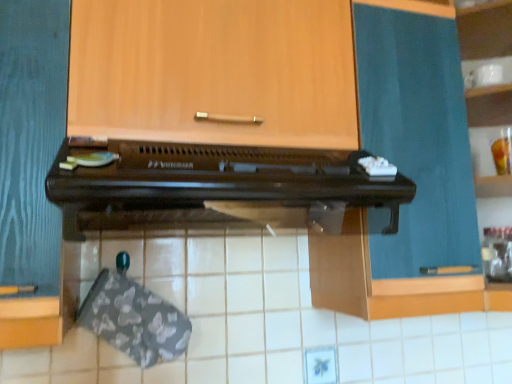
Question: From the image's perspective, does brown wooden oven at center appear higher than white glossy cup at upper right?

Choices:
 (A) no
 (B) yes

Answer: (A)

Question: Is brown wooden oven at center not close to white glossy cup at upper right?

Choices:
 (A) no
 (B) yes

Answer: (A)

Question: Is the depth of brown wooden oven at center greater than that of white glossy cup at upper right?

Choices:
 (A) no
 (B) yes

Answer: (A)

Question: Can white glossy cup at upper right be found inside brown wooden oven at center?

Choices:
 (A) no
 (B) yes

Answer: (A)

Question: From a real-world perspective, is brown wooden oven at center on top of white glossy cup at upper right?

Choices:
 (A) yes
 (B) no

Answer: (B)

Question: From a real-world perspective, is teal fabric curtain at upper right, placed as the 1th cabinetry when sorted from right to left, positioned above or below wooden cabinet at upper center, the 2th cabinetry positioned from the right?

Choices:
 (A) below
 (B) above

Answer: (A)

Question: Does point (351, 258) appear closer or farther from the camera than point (114, 9)?

Choices:
 (A) closer
 (B) farther

Answer: (B)

Question: Considering their positions, is teal fabric curtain at upper right, the 2th cabinetry positioned from the left, located in front of or behind wooden cabinet at upper center, which is the first cabinetry from left to right?

Choices:
 (A) front
 (B) behind

Answer: (B)

Question: Would you say teal fabric curtain at upper right, the 2th cabinetry positioned from the left, is inside or outside wooden cabinet at upper center, which is the first cabinetry from left to right?

Choices:
 (A) outside
 (B) inside

Answer: (A)

Question: From a real-world perspective, is wooden cabinet at upper center, which is the first cabinetry from left to right, positioned above or below teal fabric curtain at upper right, placed as the 1th cabinetry when sorted from right to left?

Choices:
 (A) above
 (B) below

Answer: (A)

Question: Would you say wooden cabinet at upper center, which is the first cabinetry from left to right, is to the left or to the right of teal fabric curtain at upper right, the 2th cabinetry positioned from the left, in the picture?

Choices:
 (A) left
 (B) right

Answer: (A)

Question: In the image, is wooden cabinet at upper center, which is the first cabinetry from left to right, positioned in front of or behind teal fabric curtain at upper right, placed as the 1th cabinetry when sorted from right to left?

Choices:
 (A) behind
 (B) front

Answer: (B)

Question: Considering the positions of wooden cabinet at upper center, which is the first cabinetry from left to right, and teal fabric curtain at upper right, placed as the 1th cabinetry when sorted from right to left, in the image, is wooden cabinet at upper center, which is the first cabinetry from left to right, taller or shorter than teal fabric curtain at upper right, placed as the 1th cabinetry when sorted from right to left,?

Choices:
 (A) short
 (B) tall

Answer: (A)

Question: In the image, is teal fabric curtain at upper right, placed as the 1th cabinetry when sorted from right to left, on the left side or the right side of brown wooden oven at center?

Choices:
 (A) right
 (B) left

Answer: (A)

Question: Based on their sizes in the image, would you say teal fabric curtain at upper right, placed as the 1th cabinetry when sorted from right to left, is bigger or smaller than brown wooden oven at center?

Choices:
 (A) big
 (B) small

Answer: (A)